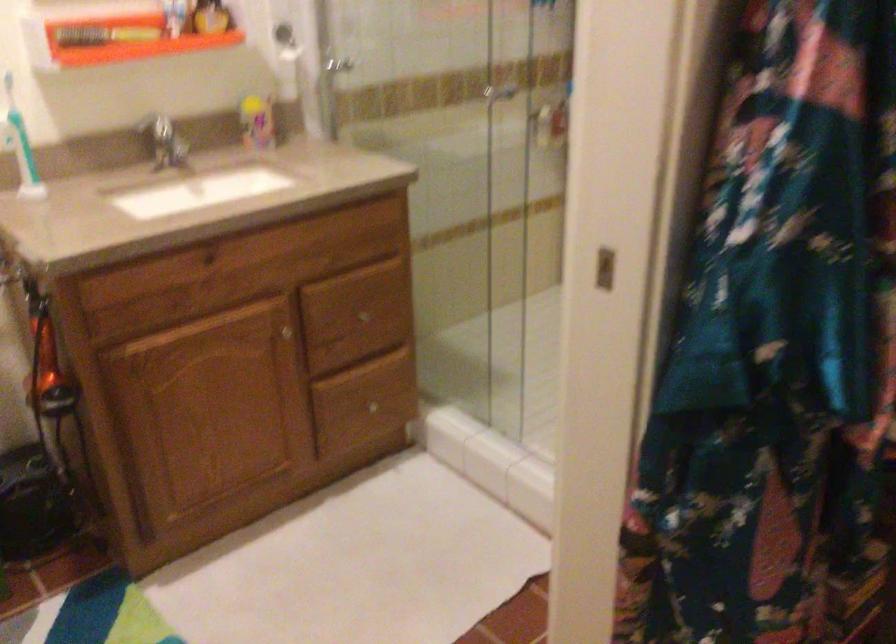
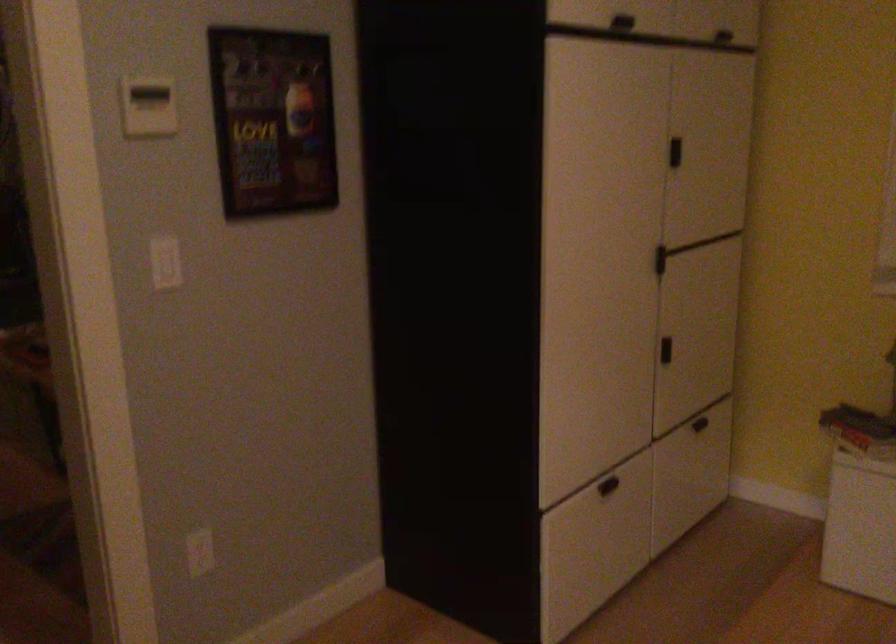
Question: The images are taken continuously from a first-person perspective. In which direction is your viewpoint rotating?

Choices:
 (A) Left
 (B) Right
 (C) Up
 (D) Down

Answer: (B)